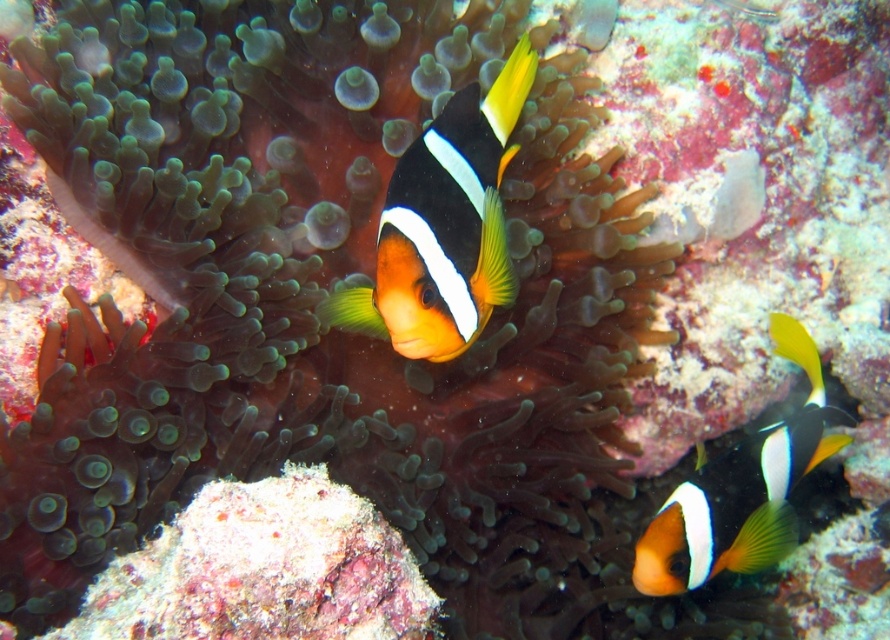
Does orange matte clownfish at center come behind orange and white clownfish at lower right?

No, orange matte clownfish at center is in front of orange and white clownfish at lower right.

This screenshot has height=640, width=890. Describe the element at coordinates (443, 227) in the screenshot. I see `orange matte clownfish at center` at that location.

Locate an element on the screen. orange matte clownfish at center is located at coordinates (443, 227).